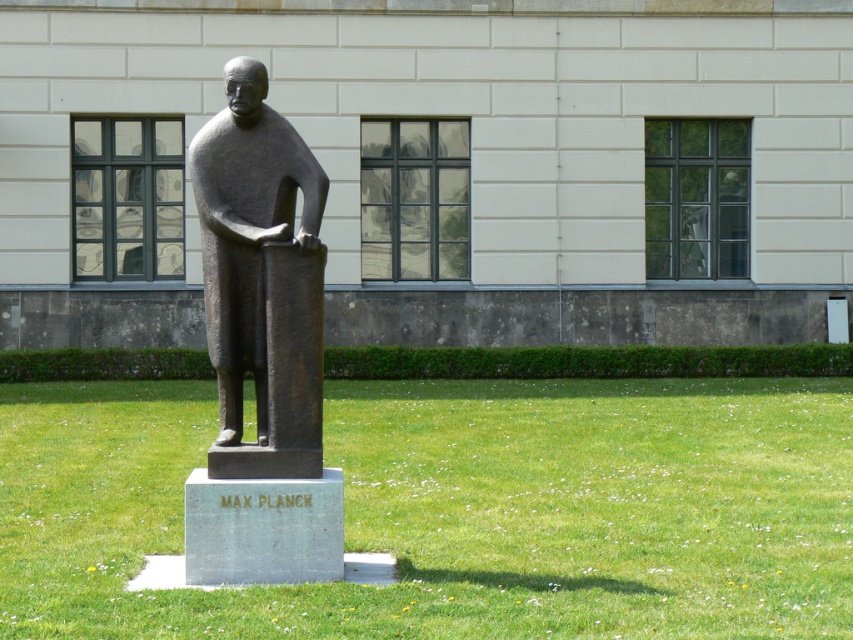
Question: Can you confirm if green grass at center is positioned above bronze statue at center?

Choices:
 (A) yes
 (B) no

Answer: (B)

Question: Can you confirm if green grass at center is positioned to the left of bronze statue at center?

Choices:
 (A) no
 (B) yes

Answer: (A)

Question: Which point appears closest to the camera in this image?

Choices:
 (A) (44, 621)
 (B) (244, 273)

Answer: (A)

Question: Can you confirm if green grass at center is positioned to the left of bronze statue at center?

Choices:
 (A) no
 (B) yes

Answer: (A)